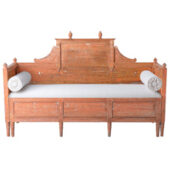
I want to click on area below bench, so [x=91, y=145].